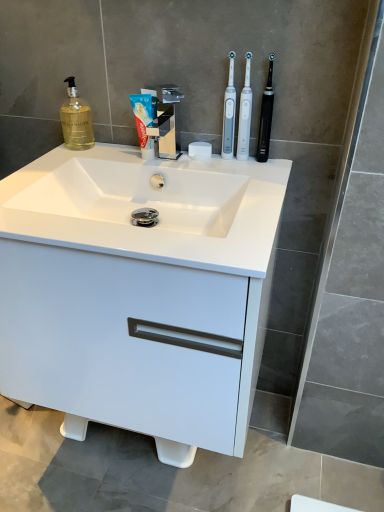
This screenshot has height=512, width=384. Find the location of `free spot to the left of white glossy toothpaste at center`. free spot to the left of white glossy toothpaste at center is located at coordinates (80, 157).